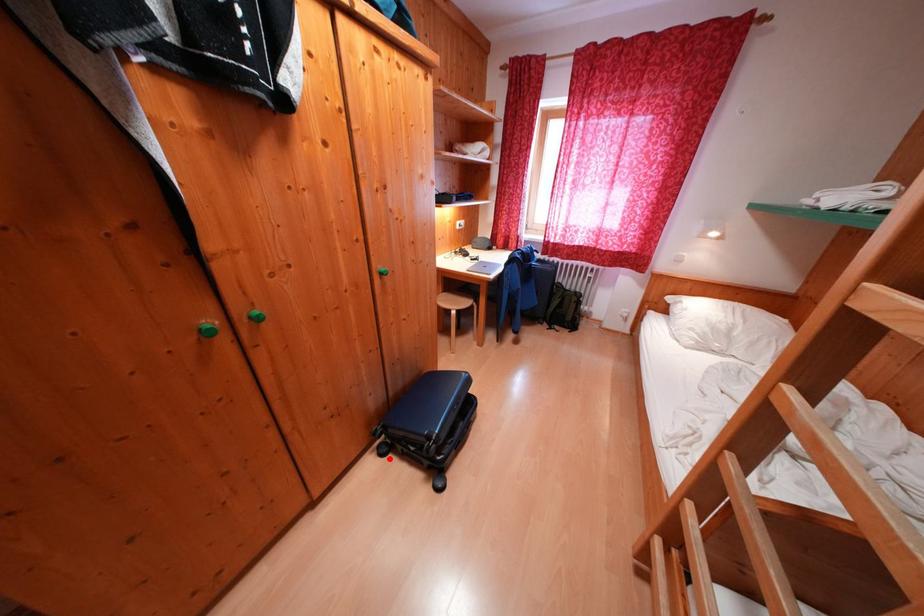
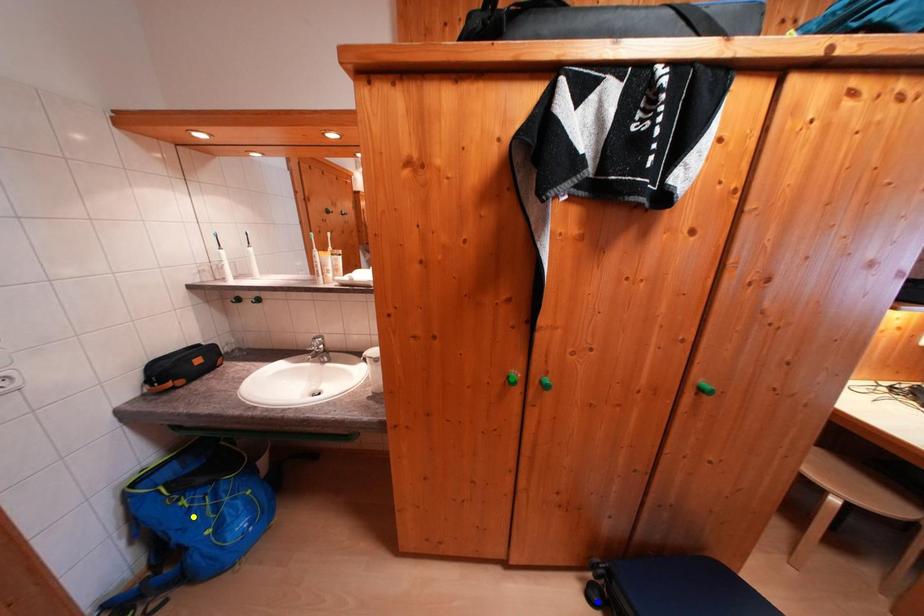
Question: I am providing you with two images of the same scene from different viewpoints. A red point is marked on the first image. You are given multiple points on the second image. Which spot in image 2 lines up with the point in image 1?

Choices:
 (A) yellow point
 (B) green point
 (C) blue point

Answer: (C)